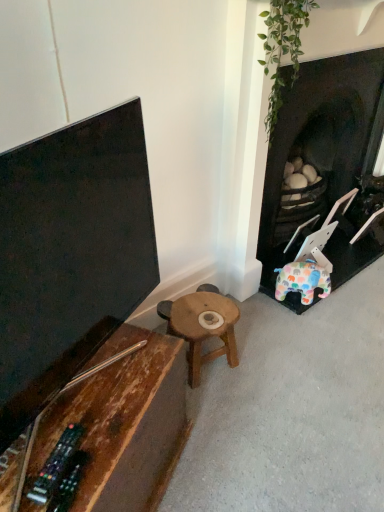
Question: Is wooden stool at center, the 2th table viewed from the front, further to the viewer compared to rustic wood table at lower left, the first table in the front-to-back sequence?

Choices:
 (A) yes
 (B) no

Answer: (A)

Question: Is rustic wood table at lower left, marked as the 2th table in a back-to-front arrangement, at the back of wooden stool at center, the 2th table viewed from the front?

Choices:
 (A) no
 (B) yes

Answer: (A)

Question: From the image's perspective, is wooden stool at center, the 2th table viewed from the front, on top of rustic wood table at lower left, marked as the 2th table in a back-to-front arrangement?

Choices:
 (A) yes
 (B) no

Answer: (A)

Question: Is wooden stool at center, the 1th table viewed from the back, shorter than rustic wood table at lower left, the first table in the front-to-back sequence?

Choices:
 (A) no
 (B) yes

Answer: (B)

Question: Is wooden stool at center, the 2th table viewed from the front, to the left of rustic wood table at lower left, the first table in the front-to-back sequence, from the viewer's perspective?

Choices:
 (A) no
 (B) yes

Answer: (A)

Question: Considering the relative sizes of wooden stool at center, the 2th table viewed from the front, and rustic wood table at lower left, the first table in the front-to-back sequence, in the image provided, is wooden stool at center, the 2th table viewed from the front, smaller than rustic wood table at lower left, the first table in the front-to-back sequence,?

Choices:
 (A) no
 (B) yes

Answer: (B)

Question: From a real-world perspective, is dark brown wood fireplace at right on rustic wood table at lower left, the first table in the front-to-back sequence?

Choices:
 (A) no
 (B) yes

Answer: (B)

Question: Could you tell me if dark brown wood fireplace at right is facing rustic wood table at lower left, the first table in the front-to-back sequence?

Choices:
 (A) yes
 (B) no

Answer: (B)

Question: Considering the relative positions of dark brown wood fireplace at right and rustic wood table at lower left, the first table in the front-to-back sequence, in the image provided, is dark brown wood fireplace at right in front of rustic wood table at lower left, the first table in the front-to-back sequence,?

Choices:
 (A) no
 (B) yes

Answer: (A)

Question: Would you say dark brown wood fireplace at right is outside rustic wood table at lower left, marked as the 2th table in a back-to-front arrangement?

Choices:
 (A) no
 (B) yes

Answer: (B)

Question: Would you say dark brown wood fireplace at right is a long distance from rustic wood table at lower left, marked as the 2th table in a back-to-front arrangement?

Choices:
 (A) yes
 (B) no

Answer: (A)

Question: Does dark brown wood fireplace at right have a larger size compared to rustic wood table at lower left, marked as the 2th table in a back-to-front arrangement?

Choices:
 (A) no
 (B) yes

Answer: (B)

Question: Is dark brown wood fireplace at right positioned before wooden stool at center, the 1th table viewed from the back?

Choices:
 (A) no
 (B) yes

Answer: (B)